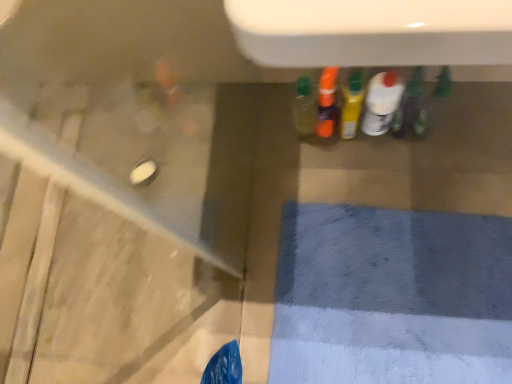
You are a GUI agent. You are given a task and a screenshot of the screen. Output one action in this format:
    pyautogui.click(x=<x>, y=<y>)
    Task: Click on the free space to the back side of translucent plastic bottle at center, the fifth bottle positioned from the right
    This screenshot has height=384, width=512.
    Given the screenshot: What is the action you would take?
    pyautogui.click(x=264, y=105)